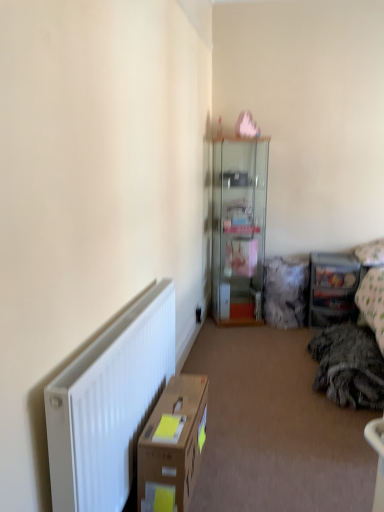
Question: Can you confirm if clear plastic storage at right is taller than white matte radiator at lower left?

Choices:
 (A) yes
 (B) no

Answer: (A)

Question: From the image's perspective, does clear plastic storage at right appear higher than white matte radiator at lower left?

Choices:
 (A) no
 (B) yes

Answer: (B)

Question: From the image's perspective, is clear plastic storage at right beneath white matte radiator at lower left?

Choices:
 (A) yes
 (B) no

Answer: (B)

Question: Is clear plastic storage at right wider than white matte radiator at lower left?

Choices:
 (A) no
 (B) yes

Answer: (B)

Question: From a real-world perspective, is clear plastic storage at right positioned under white matte radiator at lower left based on gravity?

Choices:
 (A) no
 (B) yes

Answer: (A)

Question: From a real-world perspective, is brown cardboard box at lower left positioned above or below white matte radiator at lower left?

Choices:
 (A) below
 (B) above

Answer: (B)

Question: Considering the positions of brown cardboard box at lower left and white matte radiator at lower left in the image, is brown cardboard box at lower left wider or thinner than white matte radiator at lower left?

Choices:
 (A) thin
 (B) wide

Answer: (B)

Question: Does point (196, 401) appear closer or farther from the camera than point (152, 352)?

Choices:
 (A) closer
 (B) farther

Answer: (B)

Question: Is brown cardboard box at lower left in front of or behind white matte radiator at lower left in the image?

Choices:
 (A) behind
 (B) front

Answer: (A)

Question: Is transparent glass cabinet at upper center spatially inside clear plastic storage at right, or outside of it?

Choices:
 (A) outside
 (B) inside

Answer: (A)

Question: Is transparent glass cabinet at upper center wider or thinner than clear plastic storage at right?

Choices:
 (A) thin
 (B) wide

Answer: (B)

Question: Considering the positions of point (235, 238) and point (344, 278), is point (235, 238) closer or farther from the camera than point (344, 278)?

Choices:
 (A) closer
 (B) farther

Answer: (B)

Question: In terms of size, does transparent glass cabinet at upper center appear bigger or smaller than clear plastic storage at right?

Choices:
 (A) small
 (B) big

Answer: (B)

Question: From a real-world perspective, relative to transparent glass cabinet at upper center, is brown cardboard box at lower left vertically above or below?

Choices:
 (A) below
 (B) above

Answer: (A)

Question: Is brown cardboard box at lower left inside or outside of transparent glass cabinet at upper center?

Choices:
 (A) outside
 (B) inside

Answer: (A)